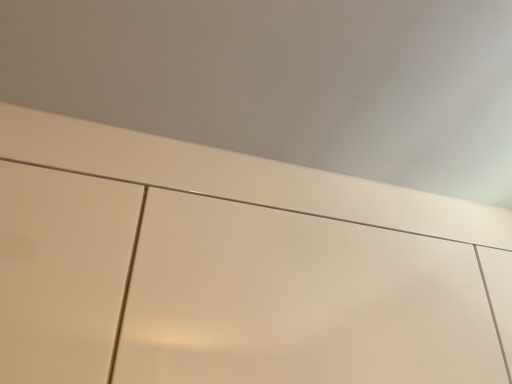
Question: Should I look upward or downward to see matte white cupboard at center?

Choices:
 (A) up
 (B) down

Answer: (B)